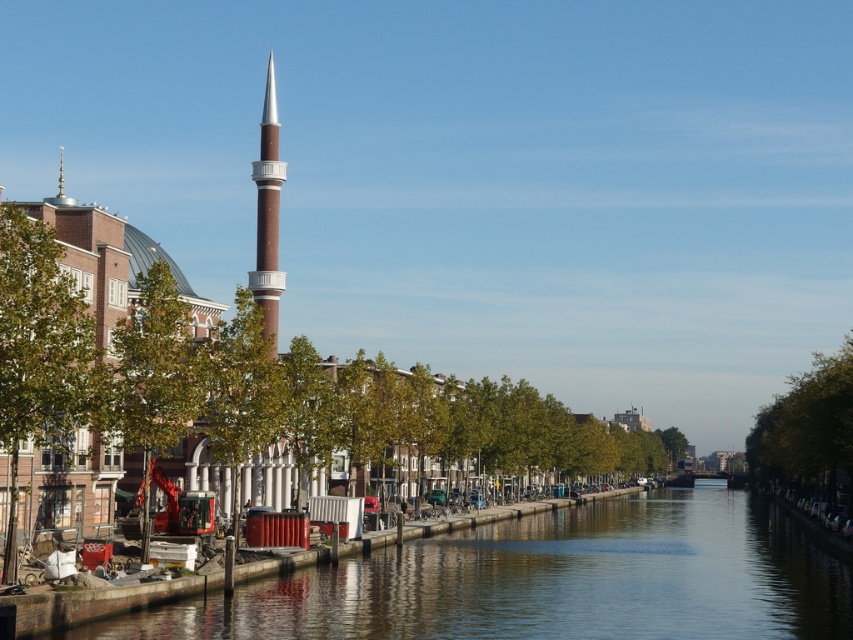
You are a tour guide leading a group along the canal. You want to point out both the smooth concrete canal at lower left and the brown glossy minaret at center to your tourists. If you are standing at the starting point, how far apart are these two landmarks?

The smooth concrete canal at lower left and the brown glossy minaret at center are 128.47 feet apart from each other.

You are standing on a bridge overlooking the smooth concrete canal at lower left. You want to throw a pebble into the water to see how far it travels. If the pebble can travel 250 feet, will it reach the end of the canal?

The smooth concrete canal at lower left is 245.65 feet away from the viewer. Since the pebble can travel 250 feet, which is slightly farther than the canal length, it will reach the end of the smooth concrete canal at lower left.

You are a tourist standing at the edge of the smooth concrete canal at lower left and want to take a photo of the brown glossy minaret at center. Since the canal is in front of you, will the minaret appear larger or smaller in your photo compared to its actual size?

The smooth concrete canal at lower left has a smaller size compared to brown glossy minaret at center, so the minaret will appear larger in your photo than its actual size.